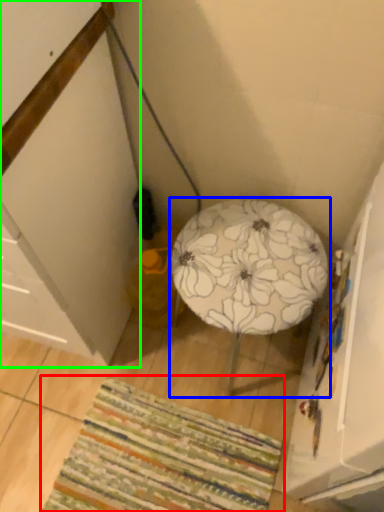
Question: Considering the real-world distances, which object is closest to mat (highlighted by a red box)? furniture (highlighted by a blue box) or cabinetry (highlighted by a green box).

Choices:
 (A) furniture
 (B) cabinetry

Answer: (B)